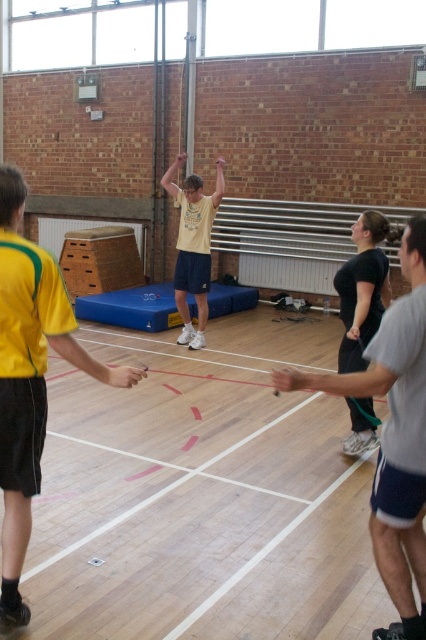
Question: Does yellow jersey at left appear on the left side of gray fabric shorts at center?

Choices:
 (A) no
 (B) yes

Answer: (B)

Question: Which object is the closest to the yellow jersey at left?

Choices:
 (A) yellow matte shirt at center
 (B) gray fabric shorts at center

Answer: (B)

Question: Observing the image, what is the correct spatial positioning of yellow jersey at left in reference to gray fabric shorts at center?

Choices:
 (A) below
 (B) above

Answer: (B)

Question: Which of these objects is positioned closest to the yellow matte shirt at center?

Choices:
 (A) gray fabric shorts at center
 (B) yellow jersey at left

Answer: (B)

Question: Which point is farther from the camera taking this photo?

Choices:
 (A) (34, 268)
 (B) (222, 177)

Answer: (B)

Question: Does gray fabric shorts at center have a smaller size compared to yellow matte shirt at center?

Choices:
 (A) yes
 (B) no

Answer: (A)